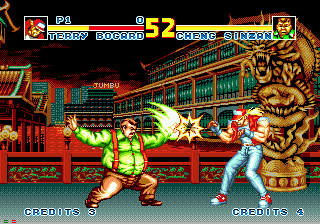
Locate an element on the screen. This screenshot has height=224, width=320. dragon statue is located at coordinates (286, 86).